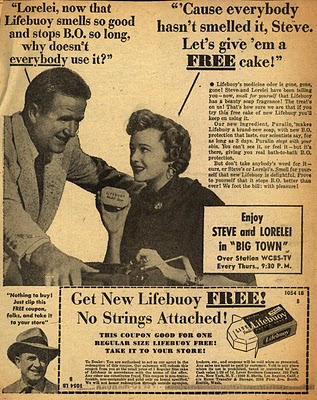
The width and height of the screenshot is (317, 400). I want to click on old newspaper, so click(x=200, y=160).